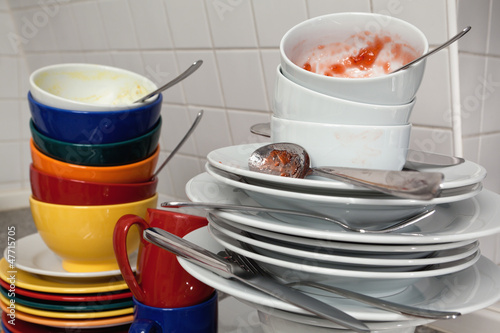
Find the location of a particular element. silverware is located at coordinates (185, 73), (191, 131), (372, 178), (415, 154), (433, 48), (316, 216), (265, 288), (313, 282).